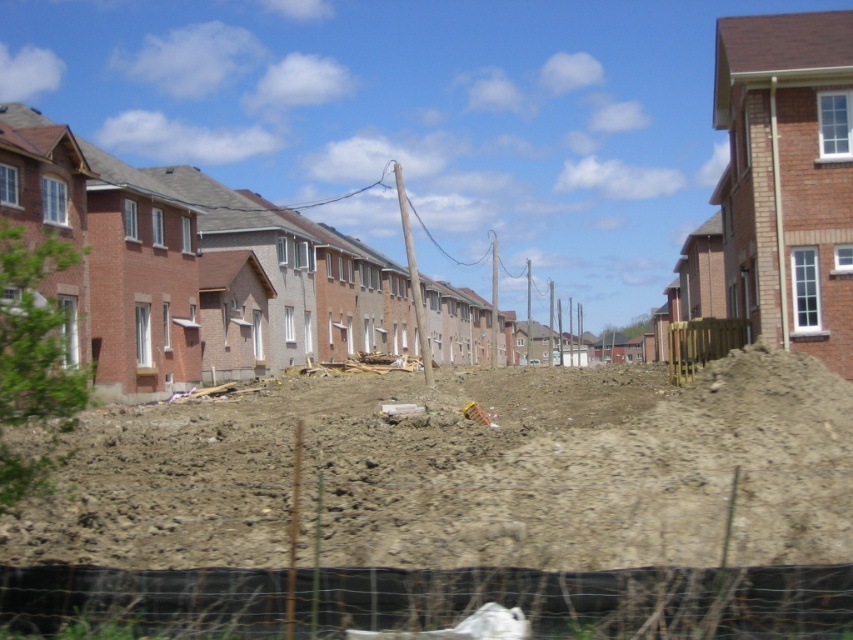
Question: Does brown/dry soil at center have a smaller size compared to brown wooden fence at center-right?

Choices:
 (A) no
 (B) yes

Answer: (A)

Question: Which object is the closest to the brown wooden fence at center-right?

Choices:
 (A) black plastic fence at lower center
 (B) brown/dry soil at center

Answer: (B)

Question: Does brown/dry soil at center appear on the left side of black plastic fence at lower center?

Choices:
 (A) yes
 (B) no

Answer: (B)

Question: Is brown/dry soil at center closer to the viewer compared to black plastic fence at lower center?

Choices:
 (A) yes
 (B) no

Answer: (B)

Question: Which of the following is the closest to the observer?

Choices:
 (A) (763, 456)
 (B) (691, 625)
 (C) (689, 348)

Answer: (B)

Question: Which point is closer to the camera?

Choices:
 (A) brown wooden fence at center-right
 (B) black plastic fence at lower center

Answer: (B)